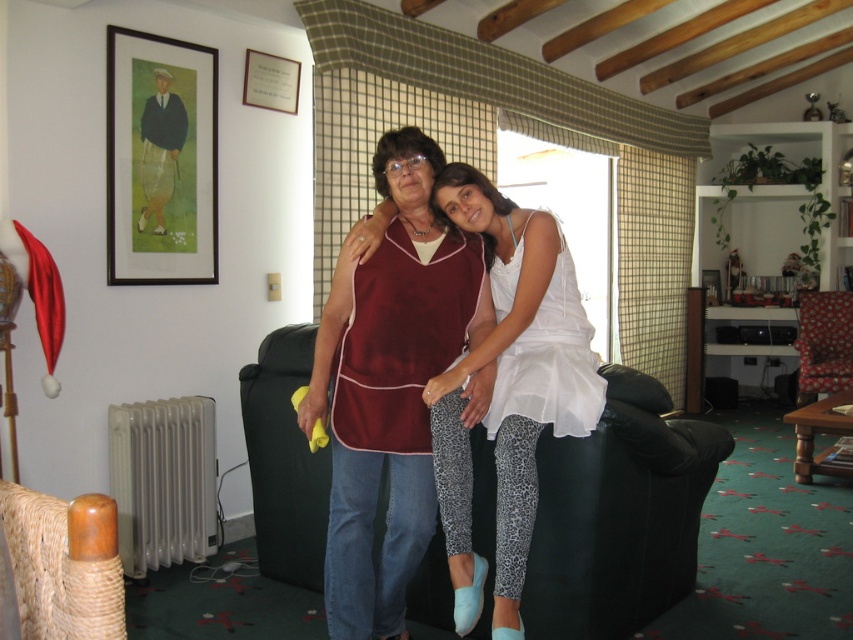
Does maroon fabric apron at center come behind floral fabric armchair at right?

No.

Who is lower down, maroon fabric apron at center or floral fabric armchair at right?

maroon fabric apron at center is below.

The width and height of the screenshot is (853, 640). I want to click on maroon fabric apron at center, so click(x=389, y=385).

You are a GUI agent. You are given a task and a screenshot of the screen. Output one action in this format:
    pyautogui.click(x=<x>, y=<y>)
    Task: Click on the maroon fabric apron at center
    
    Given the screenshot: What is the action you would take?
    pyautogui.click(x=389, y=385)

Does black leather couch at center have a greater height compared to floral fabric armchair at right?

Yes.

Looking at this image, how much distance is there between black leather couch at center and floral fabric armchair at right?

A distance of 12.57 feet exists between black leather couch at center and floral fabric armchair at right.

Is point (262, 499) farther from camera compared to point (798, 346)?

No, (262, 499) is closer to viewer.

At what (x,y) coordinates should I click in order to perform the action: click on black leather couch at center. Please return your answer as a coordinate pair (x, y). This screenshot has width=853, height=640. Looking at the image, I should click on (618, 515).

Can you confirm if velvet maroon dress at center is taller than woven straw armchair at lower left?

Yes.

Is velvet maroon dress at center above woven straw armchair at lower left?

Yes, velvet maroon dress at center is above woven straw armchair at lower left.

Where is `velvet maroon dress at center`? The image size is (853, 640). velvet maroon dress at center is located at coordinates (509, 387).

Locate an element on the screen. velvet maroon dress at center is located at coordinates (509, 387).